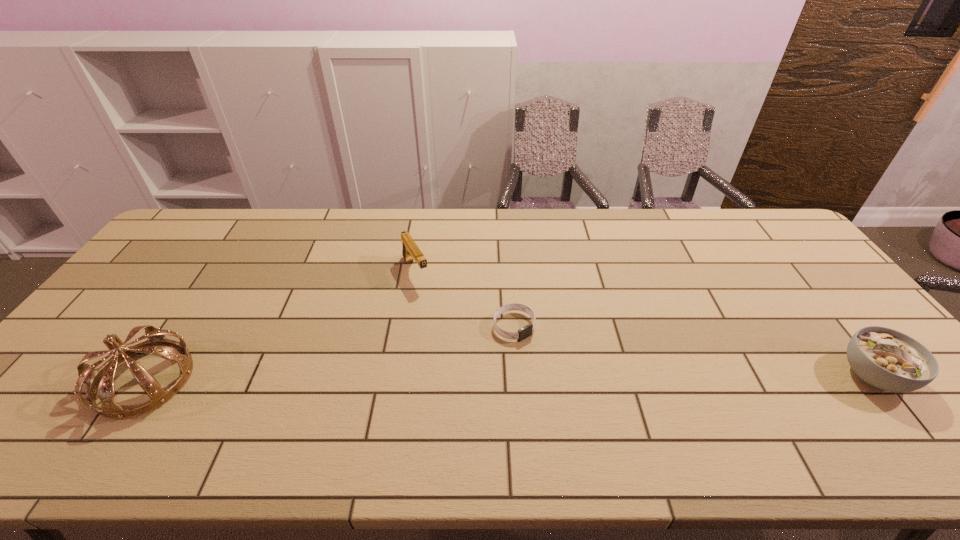
This screenshot has width=960, height=540. I want to click on object located at the near right corner, so click(884, 358).

At what (x,y) coordinates should I click in order to perform the action: click on vacant region at the far edge of the desktop. Please return your answer as a coordinate pair (x, y). This screenshot has width=960, height=540. Looking at the image, I should click on (677, 225).

The width and height of the screenshot is (960, 540). In the image, there is a desktop. In order to click on vacant space at the near edge in this screenshot , I will do `click(624, 406)`.

Identify the location of vacant area at the far left corner. (204, 247).

The image size is (960, 540). What are the coordinates of `vacant space at the near left corner` in the screenshot? It's located at [79, 410].

Find the location of a particular element. vacant region at the far right corner of the desktop is located at coordinates (756, 213).

Image resolution: width=960 pixels, height=540 pixels. What are the coordinates of `vacant area that lies between the leftmost object and the rightmost object` in the screenshot? It's located at (x=509, y=377).

The image size is (960, 540). I want to click on free point between the soup bowl and the tiara, so click(x=509, y=377).

This screenshot has height=540, width=960. In order to click on vacant area between the rightmost object and the pistol in this screenshot , I will do 644,323.

Find the location of a particular element. vacant area between the pistol and the soup bowl is located at coordinates (644, 323).